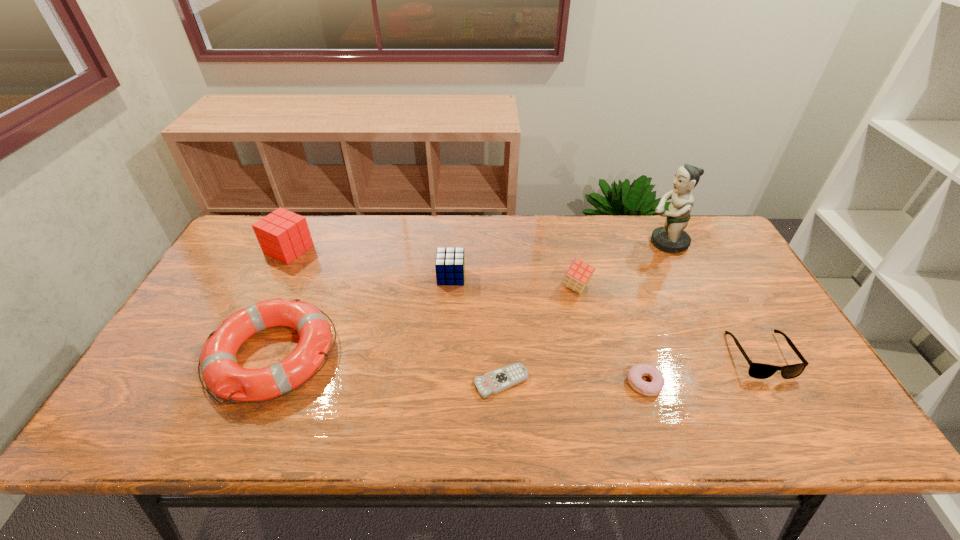
Identify which cube is located as the second nearest to the rightmost cube. Please provide its 2D coordinates. Your answer should be formatted as a tuple, i.e. [(x, y)], where the tuple contains the x and y coordinates of a point satisfying the conditions above.

[(283, 235)]

Where is `cube that is the nearest to the third shortest object`? The image size is (960, 540). cube that is the nearest to the third shortest object is located at coordinates (579, 273).